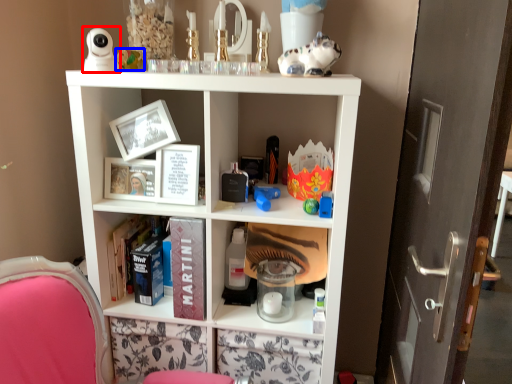
Question: Which object is closer to the camera taking this photo, toy (highlighted by a red box) or toy (highlighted by a blue box)?

Choices:
 (A) toy
 (B) toy

Answer: (A)